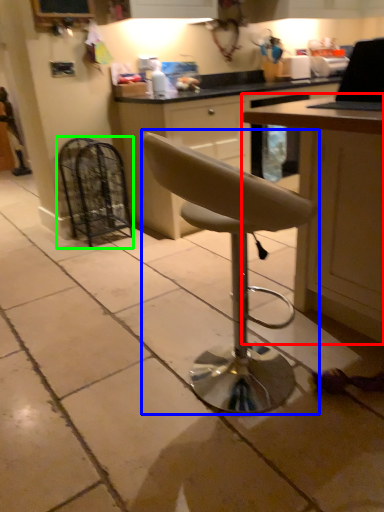
Question: Considering the real-world distances, which object is farthest from table (highlighted by a red box)? chair (highlighted by a blue box) or appliance (highlighted by a green box)?

Choices:
 (A) chair
 (B) appliance

Answer: (B)